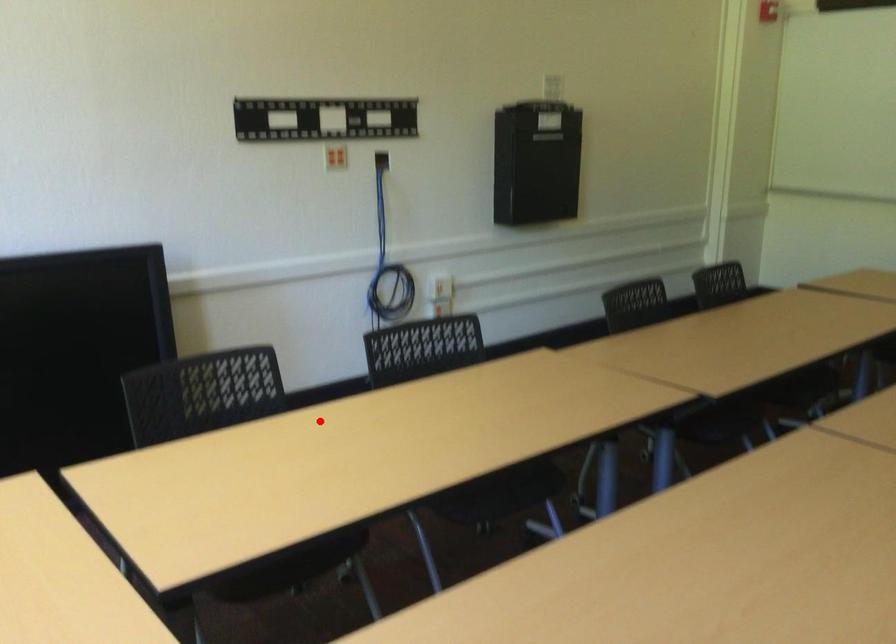
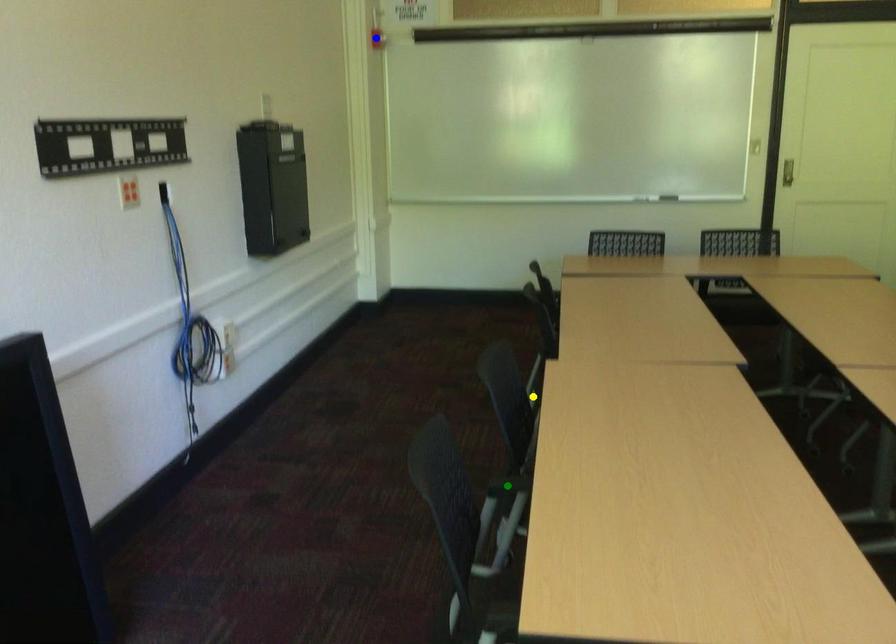
Question: I am providing you with two images of the same scene from different viewpoints. A red point is marked on the first image. You are given multiple points on the second image. In image 2, which mark is for the same physical point as the one in image 1?

Choices:
 (A) yellow point
 (B) green point
 (C) blue point

Answer: (B)